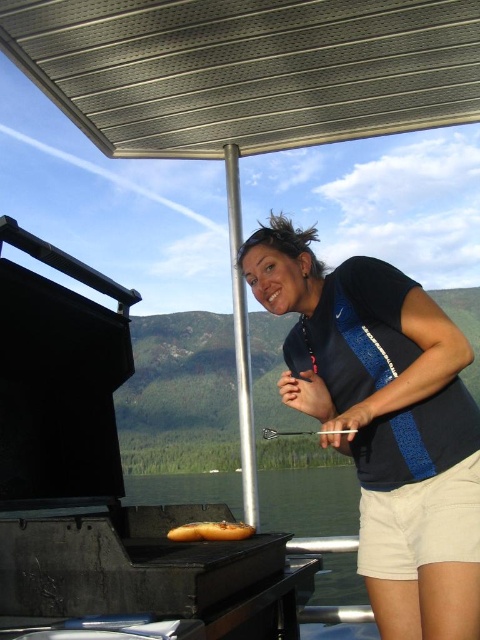
Question: Does metallic silver canopy at upper center appear on the left side of golden brown bread at center?

Choices:
 (A) yes
 (B) no

Answer: (B)

Question: Among these points, which one is nearest to the camera?

Choices:
 (A) (194, 531)
 (B) (145, 28)

Answer: (A)

Question: Based on their relative distances, which object is farther from the golden brown bread at center?

Choices:
 (A) black fabric shirt at center
 (B) metallic silver canopy at upper center

Answer: (B)

Question: Can you confirm if metallic silver canopy at upper center is bigger than black fabric shirt at center?

Choices:
 (A) yes
 (B) no

Answer: (A)

Question: Among these points, which one is farthest from the camera?

Choices:
 (A) (397, 321)
 (B) (122, 134)
 (C) (214, 529)

Answer: (B)

Question: Does metallic silver canopy at upper center have a lesser width compared to golden brown bread at center?

Choices:
 (A) no
 (B) yes

Answer: (A)